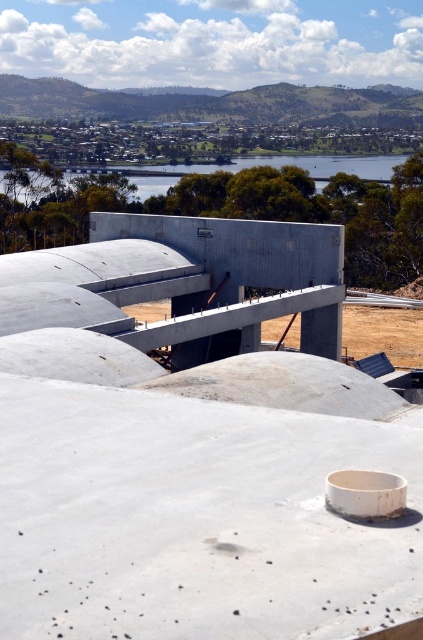
You are a construction worker standing at the edge of the construction site. You need to determine if the white smooth concrete at center is shorter than the blue water at center. Based on the scene, can you confirm this?

The white smooth concrete at center is not as tall as blue water at center, so yes, the white smooth concrete at center is shorter than the blue water at center.

You are a construction worker assessing the site. You see the white smooth concrete at center and the blue water at center. Which object occupies a larger area in the scene?

The blue water at center occupies a larger area than the white smooth concrete at center.